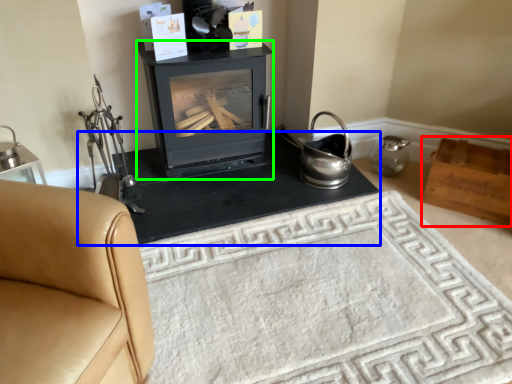
Question: Based on their relative distances, which object is nearer to box (highlighted by a red box)? Choose from table (highlighted by a blue box) and wood burning stove (highlighted by a green box).

Choices:
 (A) table
 (B) wood burning stove

Answer: (A)